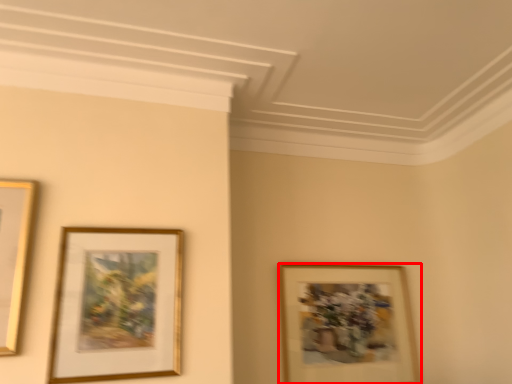
Question: In this image, where is picture frame (annotated by the red box) located relative to picture frame?

Choices:
 (A) right
 (B) left

Answer: (A)